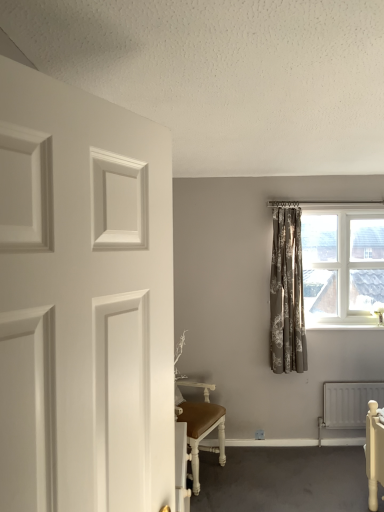
Question: Is there a large distance between neutral floral fabric curtain at center-right and white matte door at left?

Choices:
 (A) yes
 (B) no

Answer: (A)

Question: Is neutral floral fabric curtain at center-right further to the viewer compared to white matte door at left?

Choices:
 (A) no
 (B) yes

Answer: (B)

Question: Considering the relative sizes of neutral floral fabric curtain at center-right and white matte door at left in the image provided, is neutral floral fabric curtain at center-right bigger than white matte door at left?

Choices:
 (A) no
 (B) yes

Answer: (A)

Question: Is neutral floral fabric curtain at center-right next to white matte door at left and touching it?

Choices:
 (A) no
 (B) yes

Answer: (A)

Question: From a real-world perspective, is neutral floral fabric curtain at center-right physically below white matte door at left?

Choices:
 (A) yes
 (B) no

Answer: (A)

Question: Is white matte door at left surrounded by neutral floral fabric curtain at center-right?

Choices:
 (A) yes
 (B) no

Answer: (B)

Question: Is neutral floral fabric curtain at center-right oriented towards white metallic radiator at lower right?

Choices:
 (A) no
 (B) yes

Answer: (A)

Question: Does neutral floral fabric curtain at center-right have a lesser height compared to white metallic radiator at lower right?

Choices:
 (A) yes
 (B) no

Answer: (B)

Question: Is neutral floral fabric curtain at center-right behind white metallic radiator at lower right?

Choices:
 (A) yes
 (B) no

Answer: (B)

Question: Is neutral floral fabric curtain at center-right not within white metallic radiator at lower right?

Choices:
 (A) yes
 (B) no

Answer: (A)

Question: From a real-world perspective, does neutral floral fabric curtain at center-right sit lower than white metallic radiator at lower right?

Choices:
 (A) no
 (B) yes

Answer: (A)

Question: Is white metallic radiator at lower right at the back of neutral floral fabric curtain at center-right?

Choices:
 (A) no
 (B) yes

Answer: (A)

Question: Is white matte door at left not within white textured window at upper right?

Choices:
 (A) yes
 (B) no

Answer: (A)